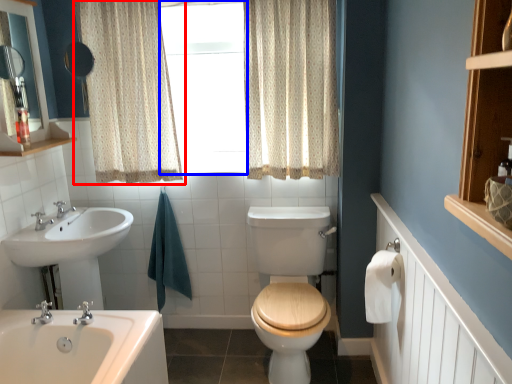
Question: Which object is further to the camera taking this photo, curtain (highlighted by a red box) or window frame (highlighted by a blue box)?

Choices:
 (A) curtain
 (B) window frame

Answer: (B)